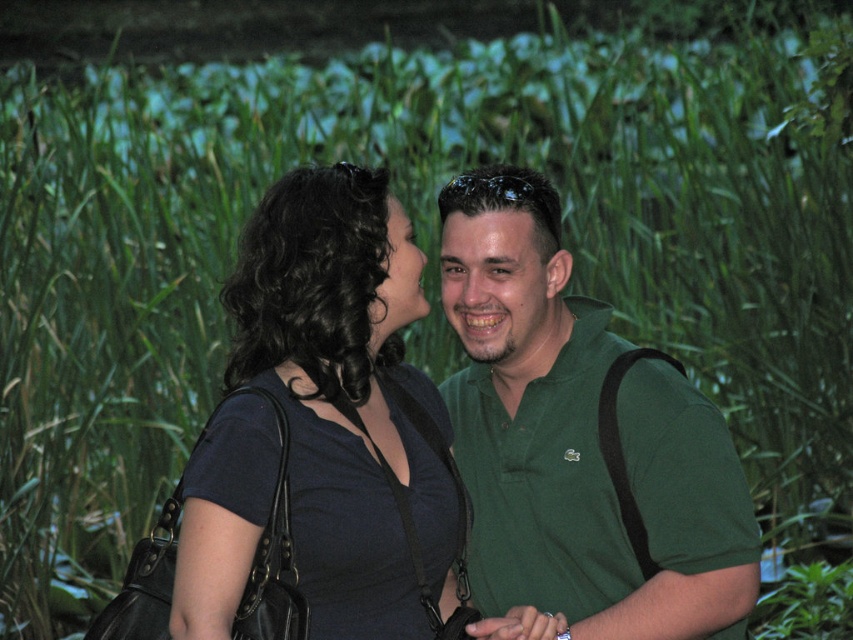
Question: Which object appears closest to the camera in this image?

Choices:
 (A) green matte shirt at center
 (B) matte black dress at center

Answer: (B)

Question: Is green matte shirt at center thinner than matte black dress at center?

Choices:
 (A) yes
 (B) no

Answer: (B)

Question: In this image, where is green matte shirt at center located relative to matte black dress at center?

Choices:
 (A) above
 (B) below

Answer: (B)

Question: Does green matte shirt at center appear under matte black dress at center?

Choices:
 (A) no
 (B) yes

Answer: (B)

Question: Which object appears closest to the camera in this image?

Choices:
 (A) green matte shirt at center
 (B) matte black dress at center

Answer: (B)

Question: Which point is farther from the camera taking this photo?

Choices:
 (A) (323, 624)
 (B) (613, 362)

Answer: (B)